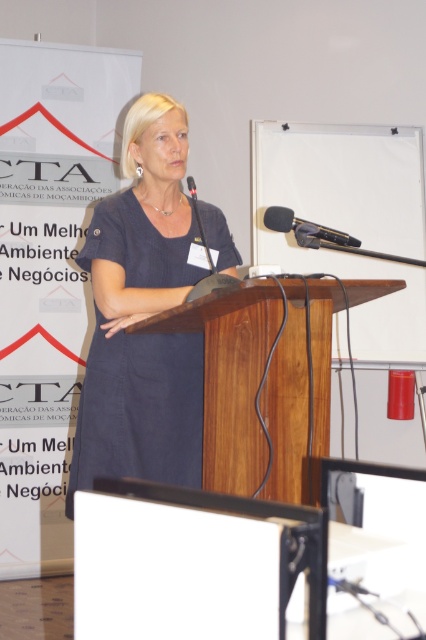
Question: Which point is farther to the camera?

Choices:
 (A) (195, 196)
 (B) (322, 244)

Answer: (A)

Question: Which object is positioned farthest from the dark blue dress at center?

Choices:
 (A) black matte microphone at center
 (B) black plastic microphone at center

Answer: (A)

Question: Does dark blue dress at center have a greater width compared to black plastic microphone at center?

Choices:
 (A) no
 (B) yes

Answer: (B)

Question: Does black matte microphone at center appear on the left side of black plastic microphone at center?

Choices:
 (A) no
 (B) yes

Answer: (A)

Question: Can you confirm if dark blue dress at center is positioned above black matte microphone at center?

Choices:
 (A) yes
 (B) no

Answer: (B)

Question: Considering the real-world distances, which object is closest to the black plastic microphone at center?

Choices:
 (A) dark blue dress at center
 (B) black matte microphone at center

Answer: (B)